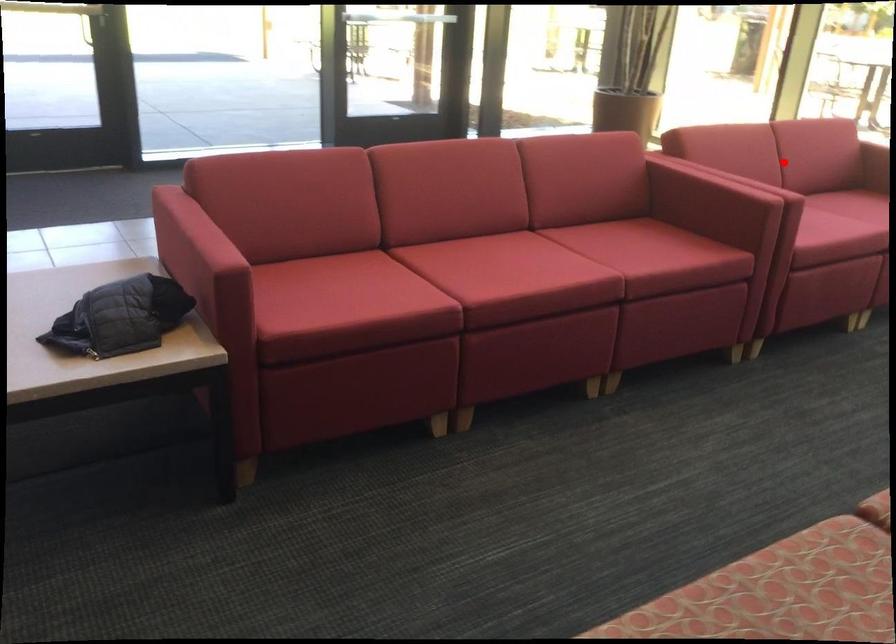
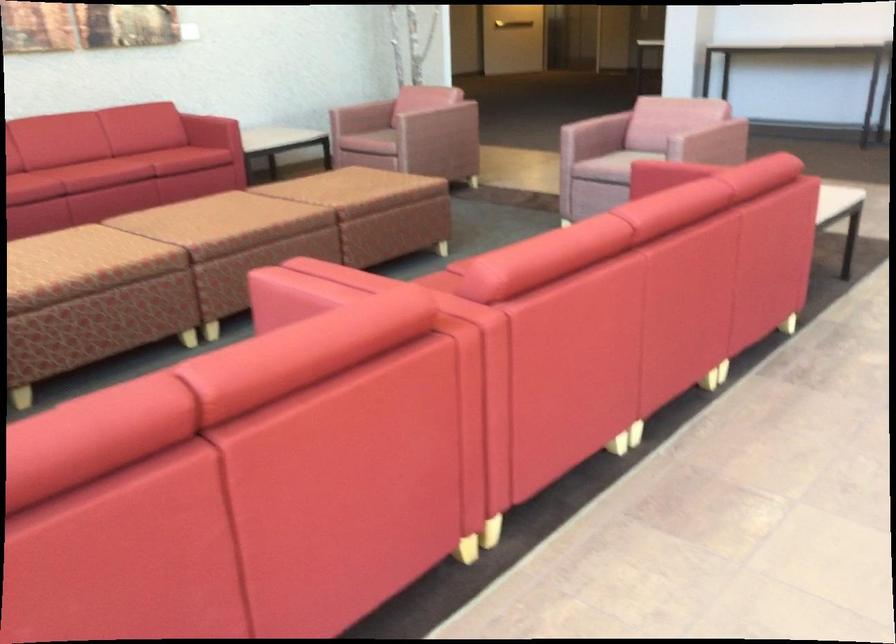
Question: I am providing you with two images of the same scene from different viewpoints. A red point is shown in image1. For the corresponding object point in image2, is it positioned nearer or farther from the camera?

Choices:
 (A) Nearer
 (B) Farther

Answer: (A)